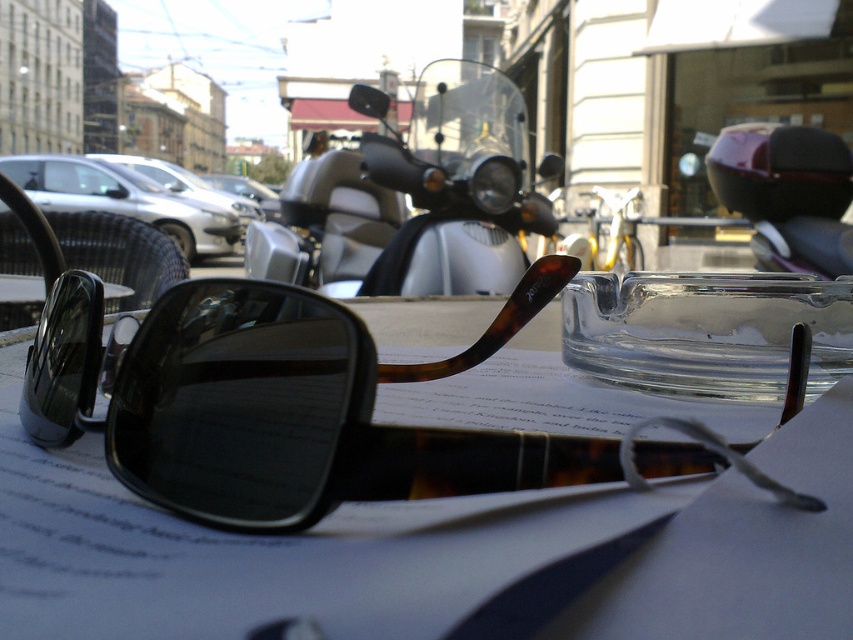
Question: Observing the image, what is the correct spatial positioning of tortoiseshell sunglasses at center in reference to metallic silver scooter at center?

Choices:
 (A) left
 (B) right

Answer: (A)

Question: Which point is closer to the camera?

Choices:
 (A) transparent glass ashtray at center
 (B) tortoiseshell sunglasses at center

Answer: (B)

Question: Which point appears farthest from the camera in this image?

Choices:
 (A) (502, 122)
 (B) (711, 296)

Answer: (A)

Question: Which point is farther to the camera?

Choices:
 (A) transparent glass ashtray at center
 (B) metallic silver scooter at center
 (C) metallic silver motorcycle at center
 (D) tortoiseshell sunglasses at center

Answer: (B)

Question: Can you confirm if transparent glass ashtray at center is wider than metallic silver motorcycle at center?

Choices:
 (A) no
 (B) yes

Answer: (B)

Question: Is tortoiseshell sunglasses at center bigger than metallic silver scooter at center?

Choices:
 (A) no
 (B) yes

Answer: (A)